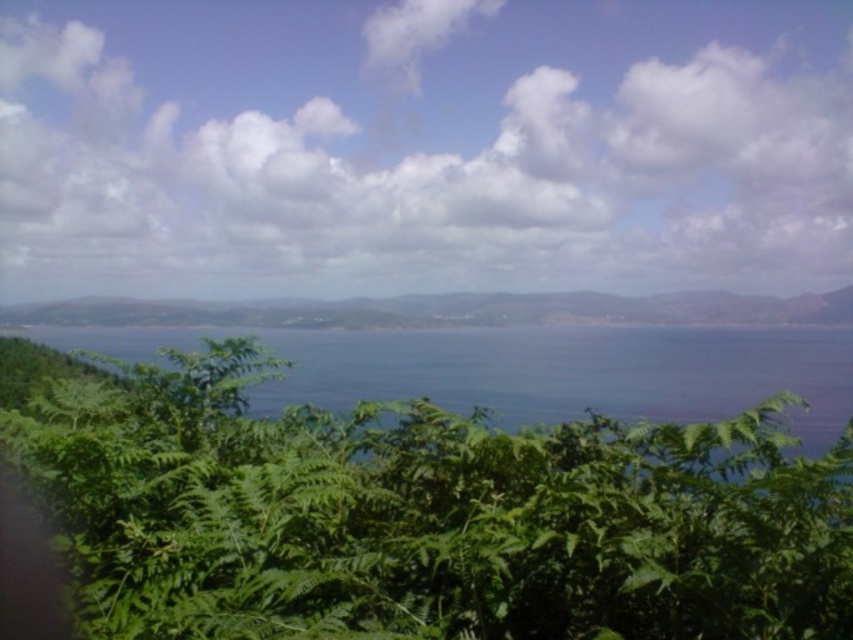
You are an artist sketching this coastal landscape. You want to ensure the white fluffy cloud at upper center and the green leafy plant at center are proportionally accurate. Which object should you draw larger?

The white fluffy cloud at upper center should be drawn larger than the green leafy plant at center because the description states it is larger in size.

You are standing in the coastal landscape and want to take a photo of both the white fluffy cloud at upper center and the green leafy plant at center. Which object should you focus on first to ensure both are in focus?

You should focus on the green leafy plant at center first because it is closer to you than the white fluffy cloud at upper center, which is further away. By focusing on the closer object, the background object will also be in focus due to the depth of field.

You are a pilot flying a small airplane and want to avoid turbulence. You see the white fluffy cloud at upper center in the distance. Is this cloud likely to cause turbulence?

The white fluffy cloud at upper center is a cumulus cloud, which typically has stable, non turbulent conditions, so it is unlikely to cause turbulence.